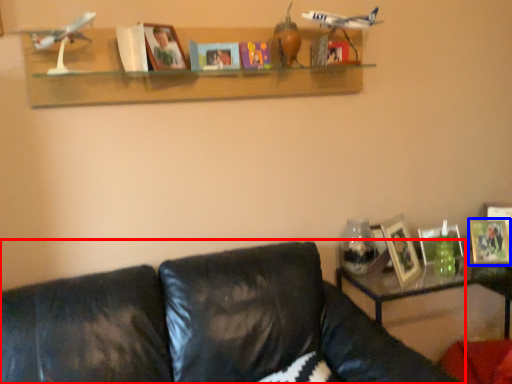
Question: Which point is further to the camera, studio couch (highlighted by a red box) or picture frame (highlighted by a blue box)?

Choices:
 (A) studio couch
 (B) picture frame

Answer: (B)